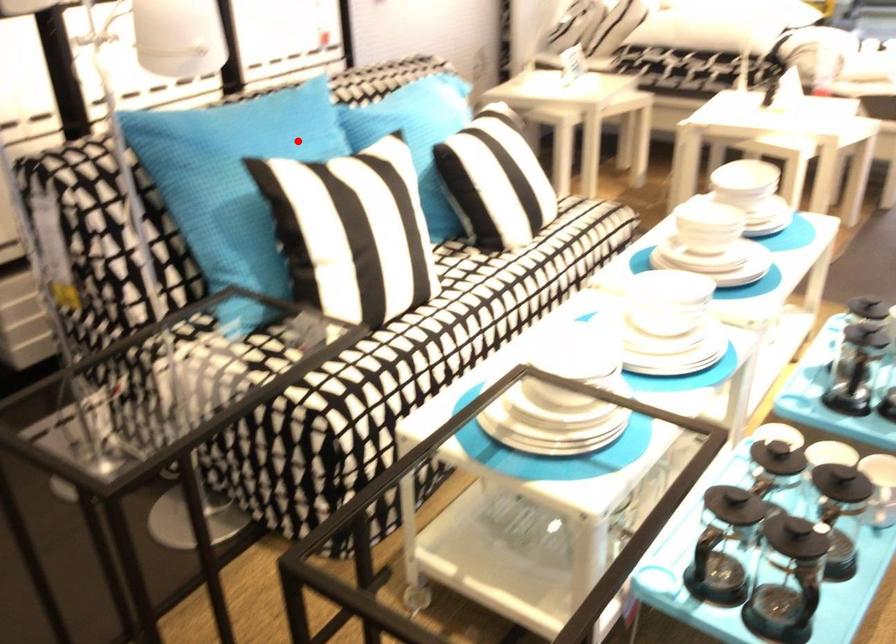
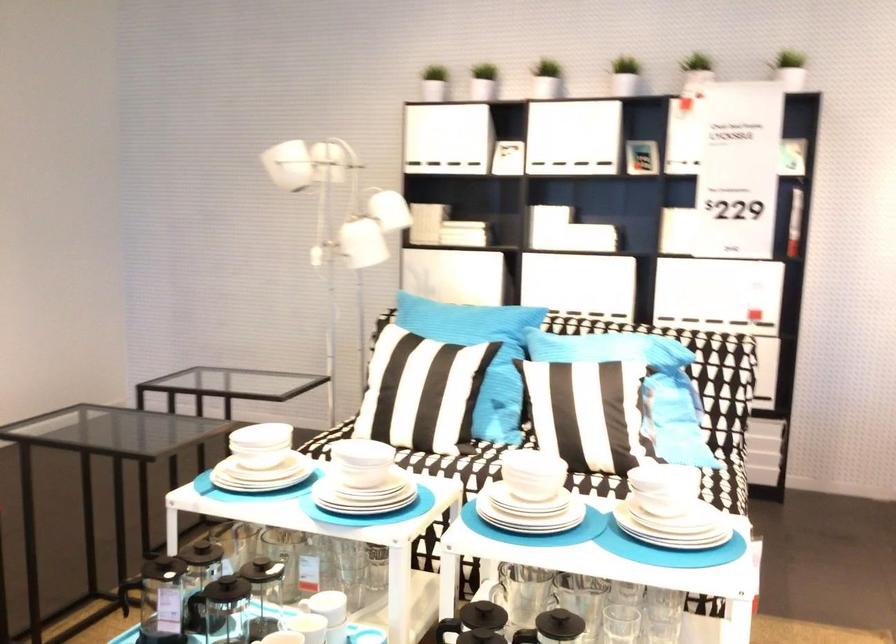
Where in the second image is the point corresponding to the highlighted location from the first image?

(467, 324)